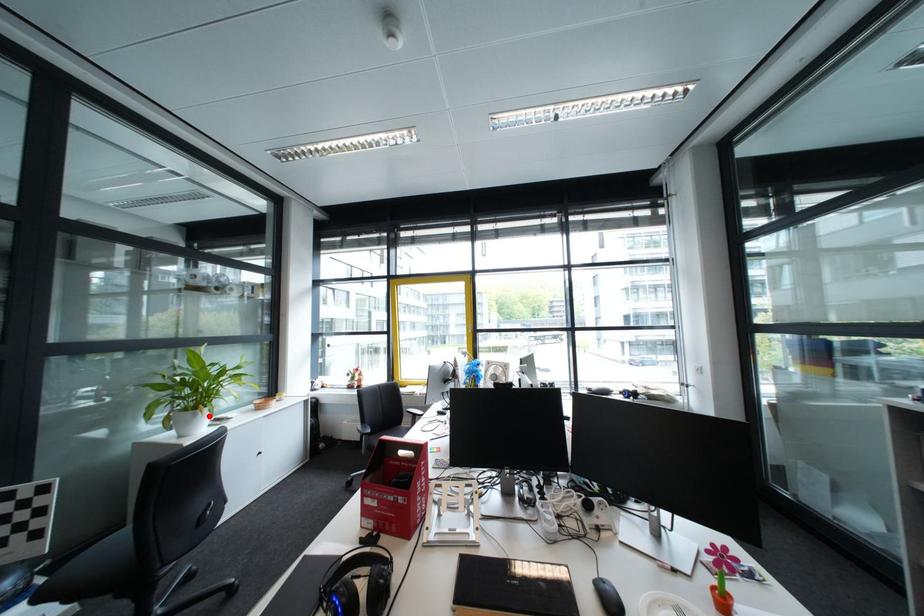
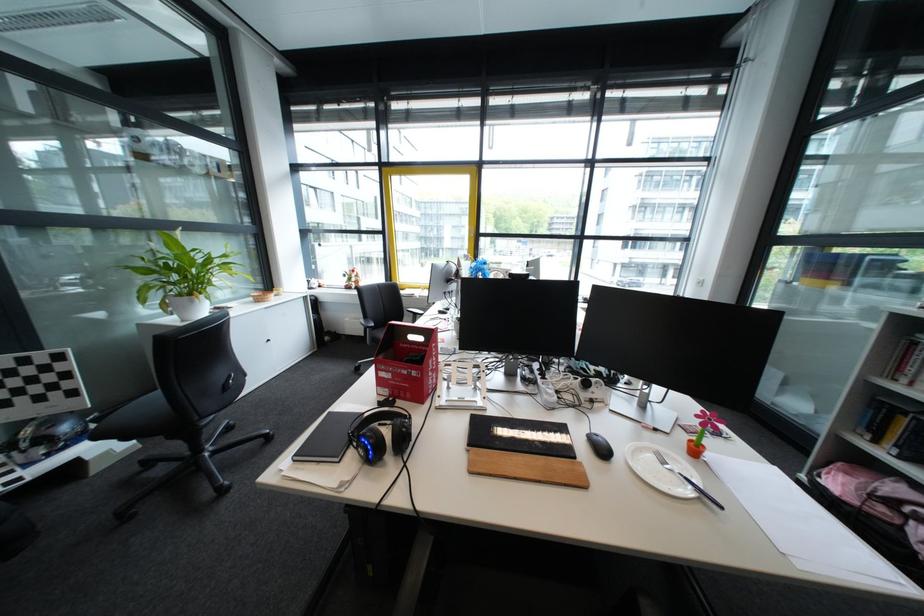
Locate, in the second image, the point that corresponds to the highlighted location in the first image.

(207, 302)